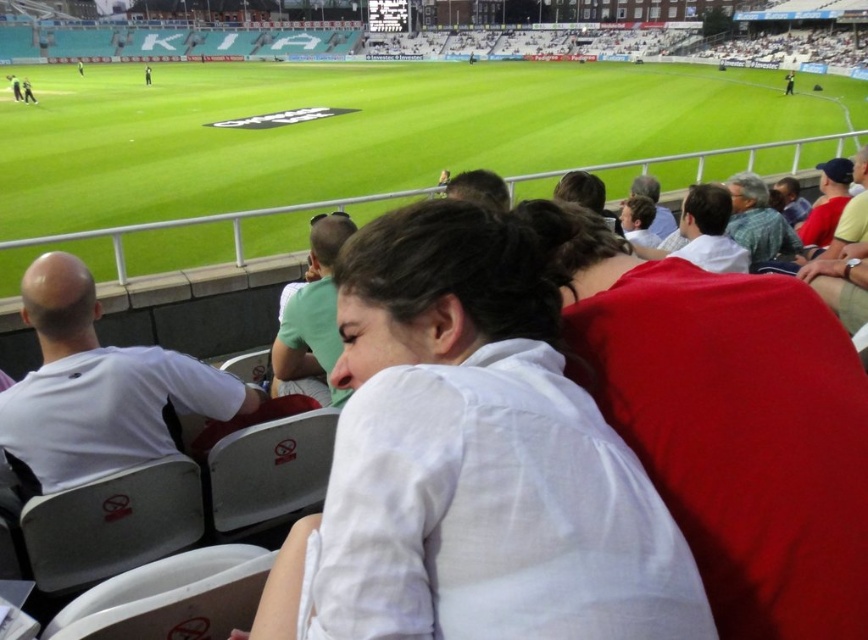
You are a photographer at the cricket stadium and want to capture a photo of the white cotton shirt at center. The stadium has a rule that you can only take photos from the north side. Given that the shirt is located at coordinate point 0.722, 0.546, can you determine if you can take a clear photo of it from the north side?

The white cotton shirt at center is located at coordinate point (x=472, y=461). Since the photographer is on the north side, they can take a clear photo of the white cotton shirt at center as long as there are no obstructions between them and the shirt.

You are a photographer at the cricket stadium and want to capture a photo of the green grass football field at center without any distractions. Since you noticed the white cotton shirt at center, where should you position the shirt relative to the field to avoid it appearing in your shot?

The white cotton shirt at center is positioned on the right side of green grass football field at center. To avoid it appearing in the photo, you should move the shirt to the left side of the green grass football field at center.